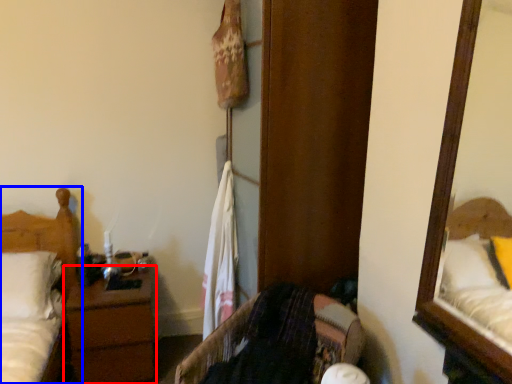
Question: Which of the following is the closest to the observer, nightstand (highlighted by a red box) or bed (highlighted by a blue box)?

Choices:
 (A) nightstand
 (B) bed

Answer: (B)